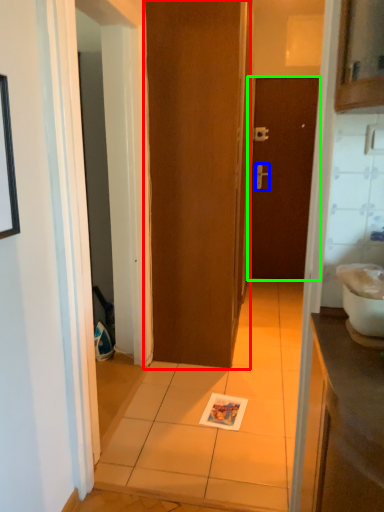
Question: Which object is positioned closest to door (highlighted by a red box)? Select from door handle (highlighted by a blue box) and door (highlighted by a green box).

Choices:
 (A) door handle
 (B) door

Answer: (B)